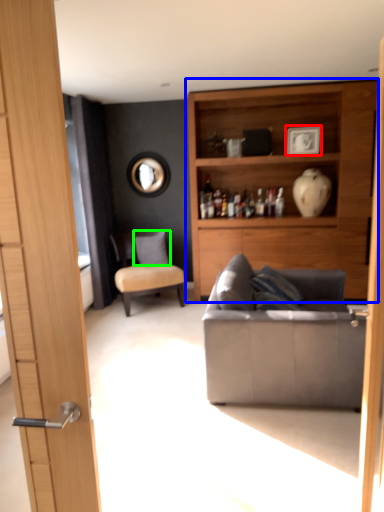
Question: Based on their relative distances, which object is farther from picture frame (highlighted by a red box)? Choose from cabinetry (highlighted by a blue box) and pillow (highlighted by a green box).

Choices:
 (A) cabinetry
 (B) pillow

Answer: (B)